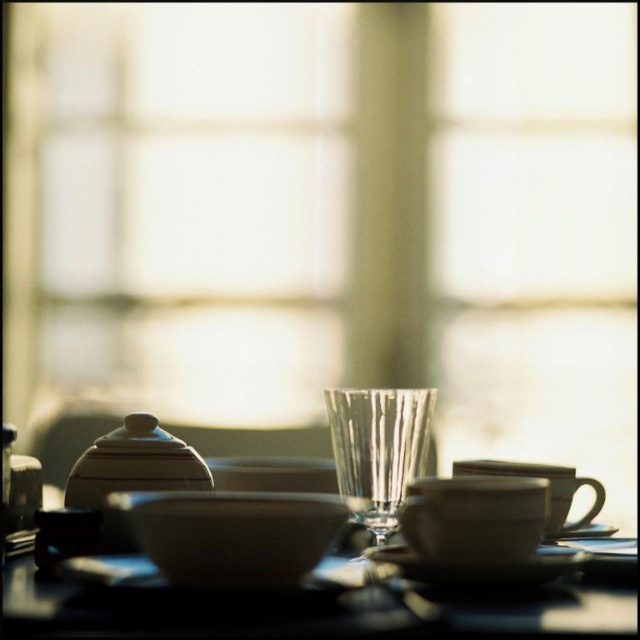
Is matte white teapot at left further to the viewer compared to white matte saucer at lower right?

No, matte white teapot at left is in front of white matte saucer at lower right.

Which is in front, point (157, 445) or point (566, 534)?

Point (157, 445)

Locate an element on the screen. The width and height of the screenshot is (640, 640). matte white teapot at left is located at coordinates (134, 464).

Does transparent glass wine glass at center lie behind black glossy saucer at center?

Yes, transparent glass wine glass at center is further from the viewer.

Between point (396, 467) and point (506, 568), which one is positioned behind?

The point (396, 467) is more distant.

Where is `transparent glass wine glass at center`? The height and width of the screenshot is (640, 640). transparent glass wine glass at center is located at coordinates (380, 445).

Is transparent glass wine glass at center taller than matte white teapot at left?

Indeed, transparent glass wine glass at center has a greater height compared to matte white teapot at left.

Is point (416, 468) closer to camera compared to point (93, 467)?

That is False.

Who is more forward, (376, 484) or (81, 467)?

Point (376, 484) is in front.

The image size is (640, 640). In order to click on transparent glass wine glass at center in this screenshot , I will do `click(380, 445)`.